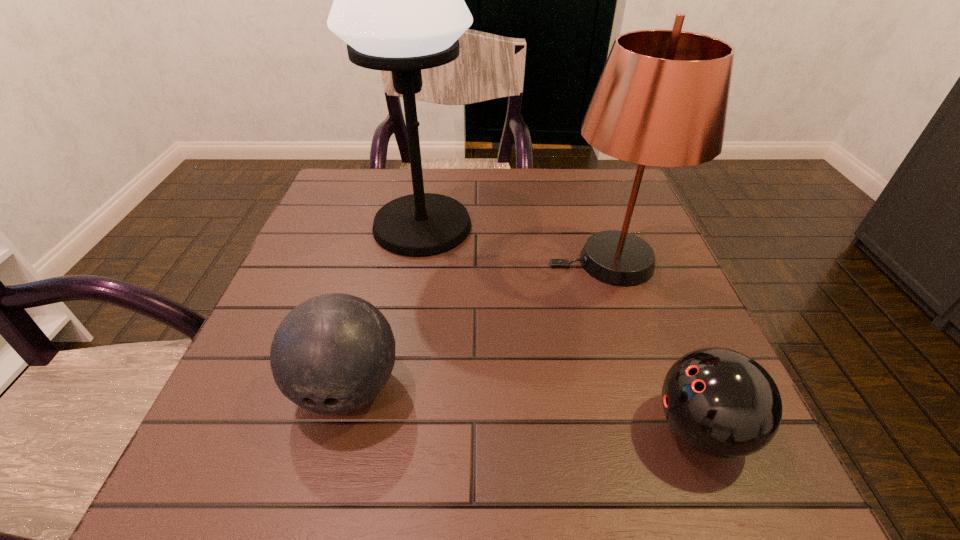
I want to click on free region located 0.400m on the surface of the right bowling ball near the finger holes, so click(383, 429).

The image size is (960, 540). What are the coordinates of `vacant space located on the surface of the right bowling ball near the finger holes` in the screenshot? It's located at (464, 429).

I want to click on free space located 0.220m on the surface of the right bowling ball near the finger holes, so click(504, 429).

I want to click on object situated at the far edge, so click(x=399, y=5).

I want to click on object that is at the near edge, so click(719, 401).

At what (x,y) coordinates should I click in order to perform the action: click on table lamp that is at the left edge. Please return your answer as a coordinate pair (x, y). This screenshot has width=960, height=540. Looking at the image, I should click on (399, 5).

Find the location of a particular element. bowling ball situated at the left edge is located at coordinates (332, 354).

Identify the location of lampshade situated at the right edge. (662, 98).

Where is `bowling ball that is at the right edge`? bowling ball that is at the right edge is located at coordinates (719, 401).

Locate an element on the screen. This screenshot has width=960, height=540. object at the far left corner is located at coordinates (399, 5).